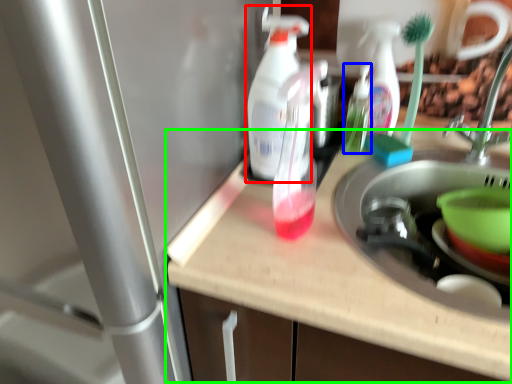
Question: Estimate the real-world distances between objects in this image. Which object is closer to cleaning product (highlighted by a red box), bottle (highlighted by a blue box) or counter top (highlighted by a green box)?

Choices:
 (A) bottle
 (B) counter top

Answer: (B)